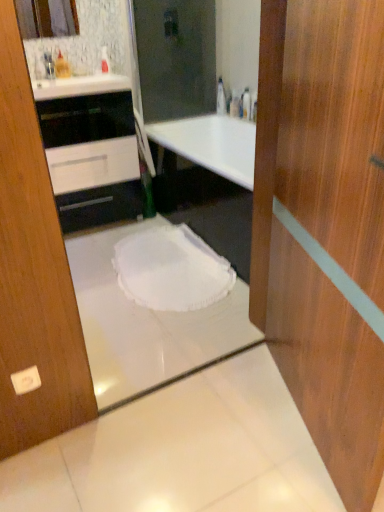
Find the location of a particular element. space that is in front of white fabric toilet at center is located at coordinates (143, 337).